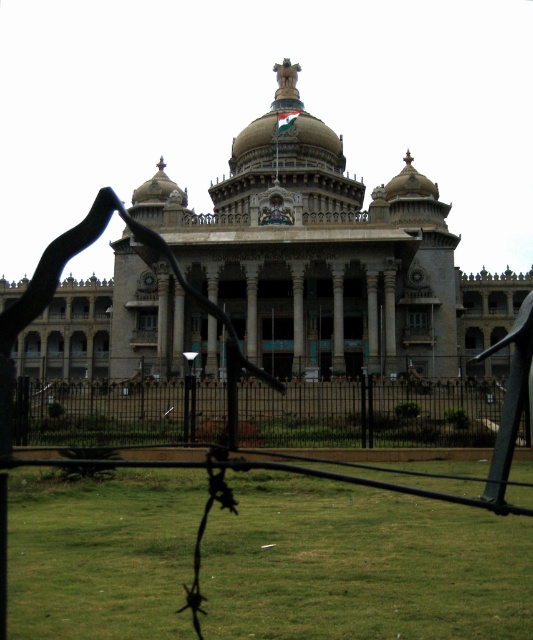
Question: Can you confirm if beige stone palace at center is thinner than black metal fence at center?

Choices:
 (A) yes
 (B) no

Answer: (B)

Question: Which point appears closest to the camera in this image?

Choices:
 (A) (151, 522)
 (B) (318, 337)

Answer: (A)

Question: Which point is farther to the camera?

Choices:
 (A) green grass at lower center
 (B) black metal fence at center

Answer: (B)

Question: Does green grass at lower center have a smaller size compared to black metal fence at center?

Choices:
 (A) no
 (B) yes

Answer: (A)

Question: Which point is farther to the camera?

Choices:
 (A) beige stone palace at center
 (B) green grass at lower center
 (C) black metal fence at center

Answer: (A)

Question: Does green grass at lower center have a larger size compared to beige stone palace at center?

Choices:
 (A) no
 (B) yes

Answer: (A)